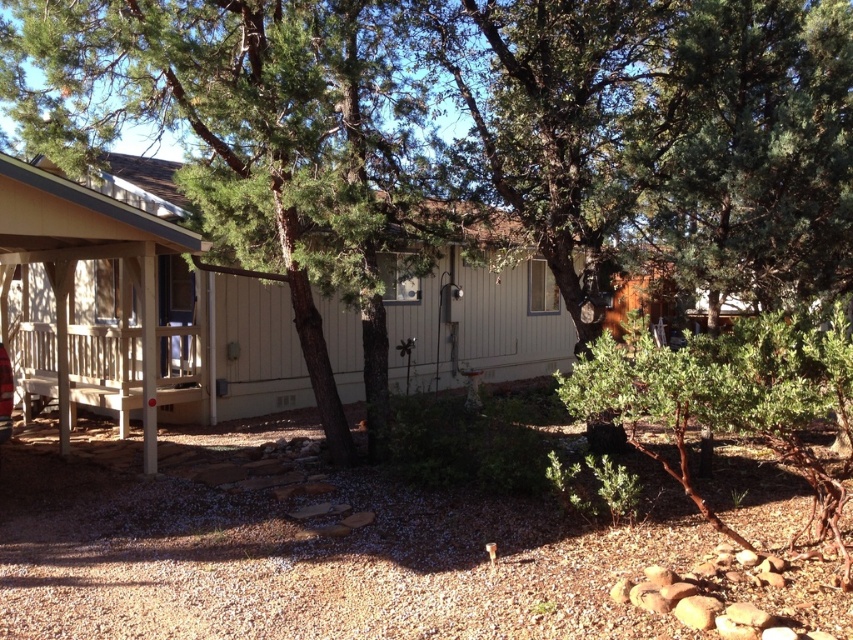
Can you confirm if beige wood porch at lower left is shorter than metallic red car at lower left?

In fact, beige wood porch at lower left may be taller than metallic red car at lower left.

Can you confirm if beige wood porch at lower left is bigger than metallic red car at lower left?

Correct, beige wood porch at lower left is larger in size than metallic red car at lower left.

Identify the location of beige wood porch at lower left. (477, 323).

Is point (381, 44) in front of point (132, 346)?

That is True.

Which is behind, point (117, 20) or point (474, 358)?

Point (474, 358)

The width and height of the screenshot is (853, 640). In order to click on green leafy tree at center in this screenshot , I will do `click(468, 131)`.

Which is more to the right, green leafy tree at center or metallic red car at lower left?

green leafy tree at center

Is green leafy tree at center above metallic red car at lower left?

Yes.

The height and width of the screenshot is (640, 853). Identify the location of green leafy tree at center. (468, 131).

I want to click on green leafy tree at center, so click(x=468, y=131).